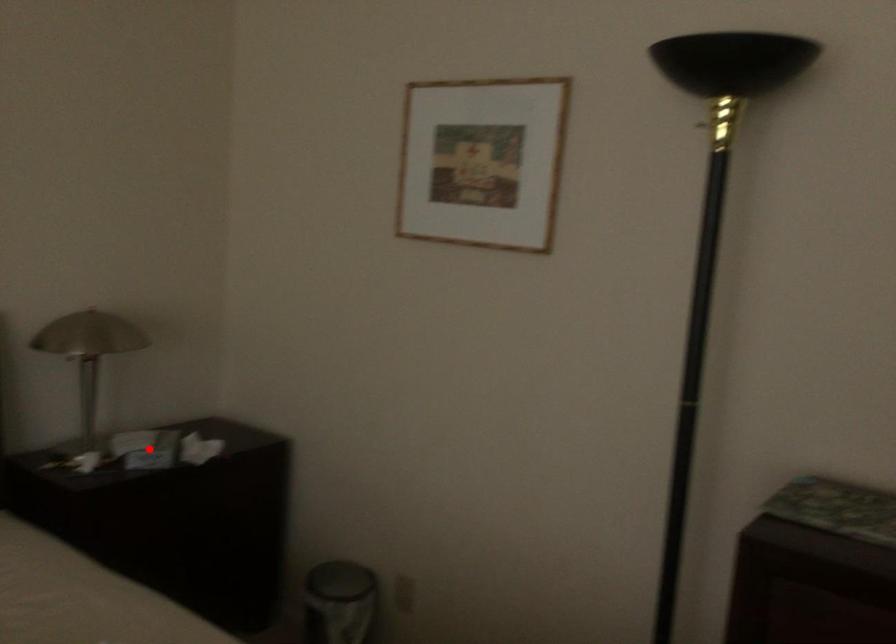
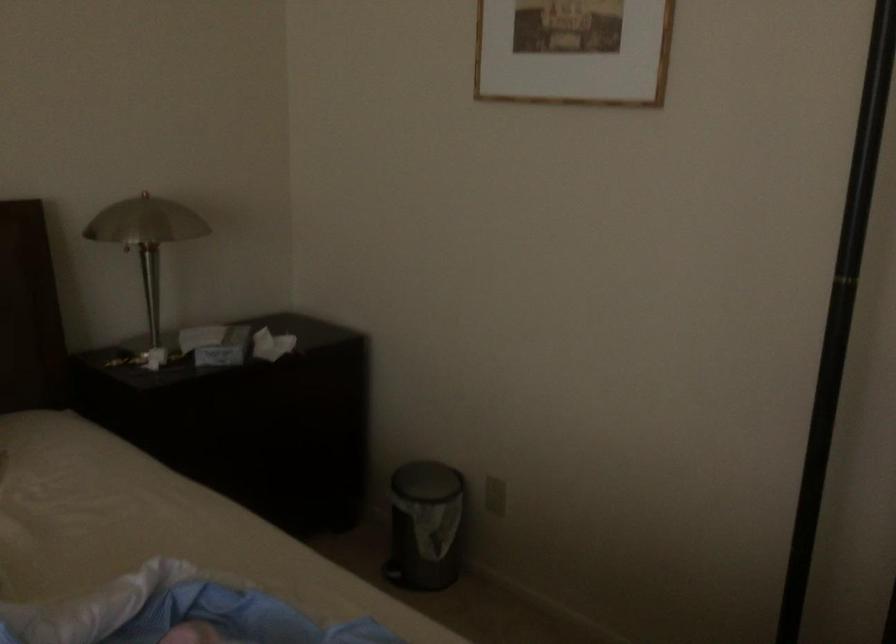
Where in the second image is the point corresponding to the highlighted location from the first image?

(216, 344)